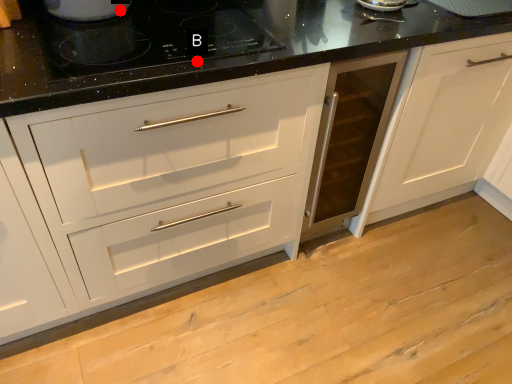
Question: Two points are circled on the image, labeled by A and B beside each circle. Which of the following is the farthest from the observer?

Choices:
 (A) A is further
 (B) B is further

Answer: (A)